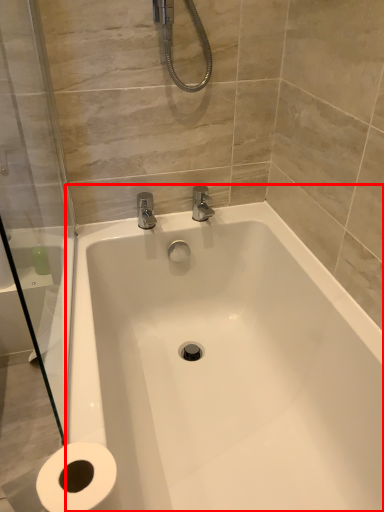
Question: Where is bathtub (annotated by the red box) located in relation to shower door in the image?

Choices:
 (A) left
 (B) right

Answer: (B)